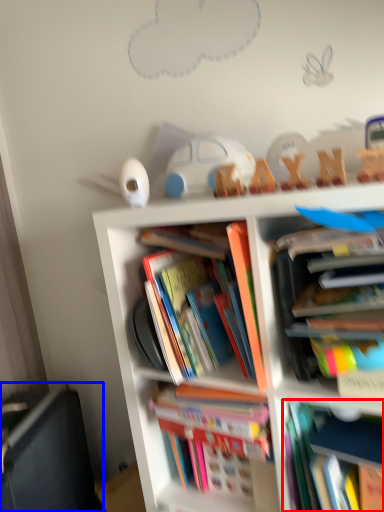
Question: Among these objects, which one is nearest to the camera, book (highlighted by a red box) or shelf (highlighted by a blue box)?

Choices:
 (A) book
 (B) shelf

Answer: (A)